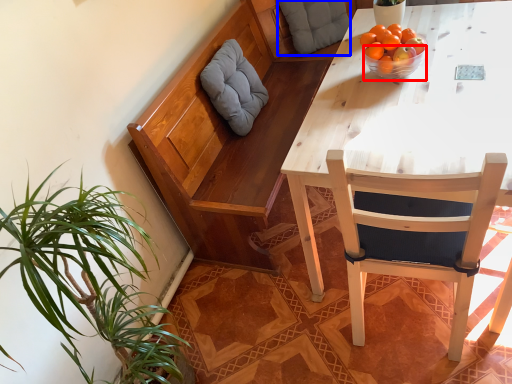
Question: Which point is closer to the camera, bowl (highlighted by a red box) or pillow (highlighted by a blue box)?

Choices:
 (A) bowl
 (B) pillow

Answer: (A)